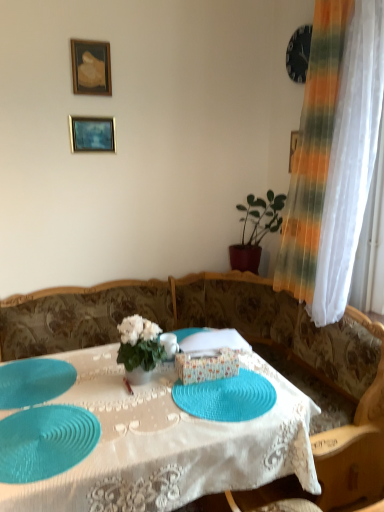
Question: Is teal rubber placemat at center wider than gold-framed painting at upper left, arranged as the first picture frame when viewed from the top?

Choices:
 (A) no
 (B) yes

Answer: (B)

Question: Is teal rubber placemat at center in contact with gold-framed painting at upper left, which is the 2th picture frame from bottom to top?

Choices:
 (A) yes
 (B) no

Answer: (B)

Question: Is teal rubber placemat at center turned away from gold-framed painting at upper left, which is the 2th picture frame from bottom to top?

Choices:
 (A) no
 (B) yes

Answer: (A)

Question: From the image's perspective, does teal rubber placemat at center appear lower than gold-framed painting at upper left, arranged as the first picture frame when viewed from the top?

Choices:
 (A) no
 (B) yes

Answer: (B)

Question: Can you confirm if teal rubber placemat at center is smaller than gold-framed painting at upper left, which is the 2th picture frame from bottom to top?

Choices:
 (A) yes
 (B) no

Answer: (B)

Question: Is teal rubber placemat at center facing towards gold-framed painting at upper left, arranged as the first picture frame when viewed from the top?

Choices:
 (A) yes
 (B) no

Answer: (B)

Question: From a real-world perspective, is gold-framed painting at upper left, arranged as the first picture frame when viewed from the top, physically below teal rubber placemat at center?

Choices:
 (A) no
 (B) yes

Answer: (A)

Question: Could you tell me if gold-framed painting at upper left, arranged as the first picture frame when viewed from the top, is facing teal rubber placemat at center?

Choices:
 (A) yes
 (B) no

Answer: (B)

Question: Are gold-framed painting at upper left, which is the 2th picture frame from bottom to top, and teal rubber placemat at center located far from each other?

Choices:
 (A) no
 (B) yes

Answer: (B)

Question: From the image's perspective, does gold-framed painting at upper left, arranged as the first picture frame when viewed from the top, appear higher than teal rubber placemat at center?

Choices:
 (A) yes
 (B) no

Answer: (A)

Question: Does gold-framed painting at upper left, arranged as the first picture frame when viewed from the top, have a greater width compared to teal rubber placemat at center?

Choices:
 (A) yes
 (B) no

Answer: (B)

Question: Is gold-framed painting at upper left, arranged as the first picture frame when viewed from the top, smaller than teal rubber placemat at center?

Choices:
 (A) yes
 (B) no

Answer: (A)

Question: Can we say gold-framed painting at upper left, which is the 2th picture frame from bottom to top, lies outside teal rubber placemat at lower left, positioned as the 1th glass plate in left-to-right order?

Choices:
 (A) yes
 (B) no

Answer: (A)